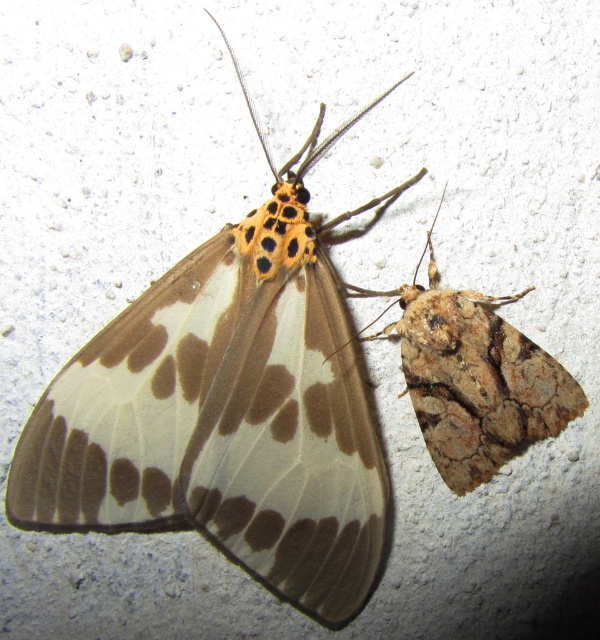
You are an entomologist examining a wall where moths are resting. You notice a translucent brown moth at upper left. Can you determine its exact 2D coordinates on the wall?

The translucent brown moth at upper left is located at coordinates 0.639 on the x axis and 0.382 on the y axis.

You are an entomologist observing two moths on a wall. You notice the translucent brown moth at upper left and the brown textured moth at right. Which moth has a greater width?

The translucent brown moth at upper left has a greater width than the brown textured moth at right according to the description.

You are standing in front of a wall with two moths. There is a specific point at coordinates point (x=121, y=456) that you want to reach. If your arm can extend 4 feet, can you touch that point?

The point (x=121, y=456) is 4.34 feet away from the camera, so your arm can only reach 4 feet, which is shorter than the distance to the point. Therefore, you cannot touch the point.